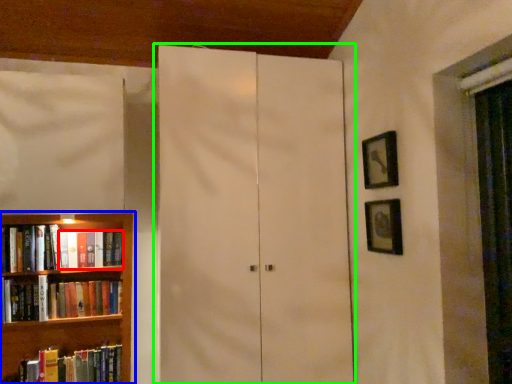
Question: Estimate the real-world distances between objects in this image. Which object is closer to book (highlighted by a red box), bookcase (highlighted by a blue box) or cupboard (highlighted by a green box)?

Choices:
 (A) bookcase
 (B) cupboard

Answer: (A)